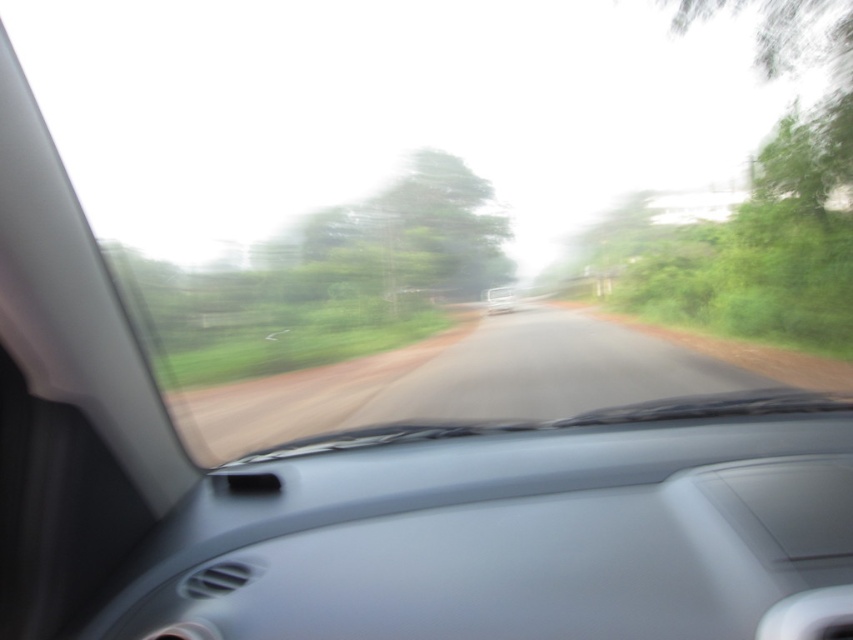
Question: Which of the following is the closest to the observer?

Choices:
 (A) green leafy tree at center
 (B) white glossy car at center

Answer: (A)

Question: Is green leafy tree at center above white glossy car at center?

Choices:
 (A) no
 (B) yes

Answer: (B)

Question: Where is green leafy tree at center located in relation to white glossy car at center in the image?

Choices:
 (A) below
 (B) above

Answer: (B)

Question: Among these points, which one is nearest to the camera?

Choices:
 (A) (486, 307)
 (B) (119, 259)

Answer: (B)

Question: Does green leafy tree at center have a larger size compared to white glossy car at center?

Choices:
 (A) no
 (B) yes

Answer: (B)